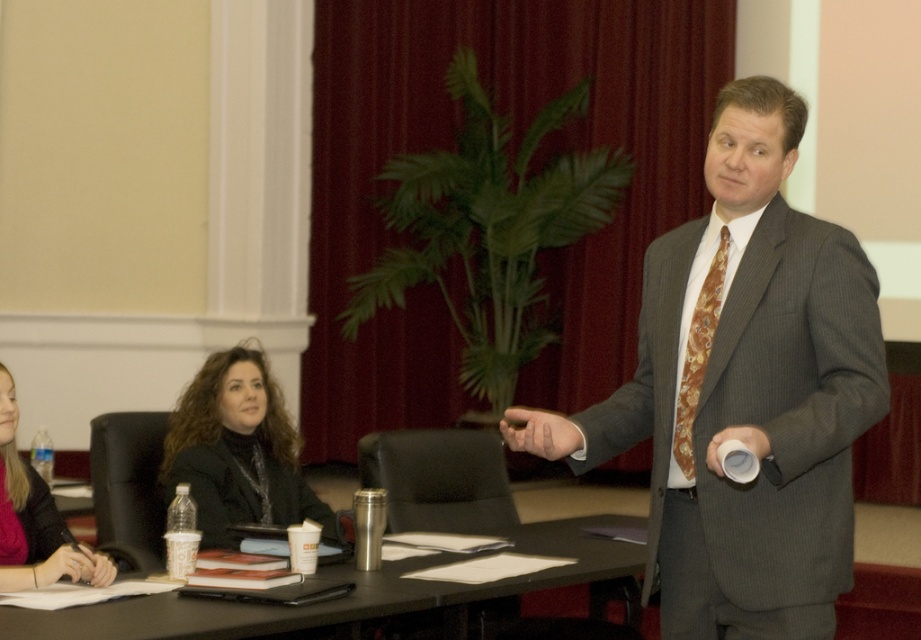
Question: Which object is the farthest from the matte black jacket at lower left?

Choices:
 (A) black leather jacket at center
 (B) brown silk tie at center

Answer: (B)

Question: Among these objects, which one is farthest from the camera?

Choices:
 (A) gray pinstripe suit at center
 (B) black plastic table at lower center
 (C) matte black jacket at lower left
 (D) brown silk tie at center

Answer: (C)

Question: Does black plastic table at lower center appear under black leather jacket at center?

Choices:
 (A) yes
 (B) no

Answer: (A)

Question: Can you confirm if gray pinstripe suit at center is bigger than black plastic table at lower center?

Choices:
 (A) no
 (B) yes

Answer: (A)

Question: Can you confirm if gray pinstripe suit at center is positioned below black leather jacket at center?

Choices:
 (A) no
 (B) yes

Answer: (A)

Question: Which of the following is the farthest from the observer?

Choices:
 (A) (791, 307)
 (B) (724, 246)
 (C) (618, 522)

Answer: (C)